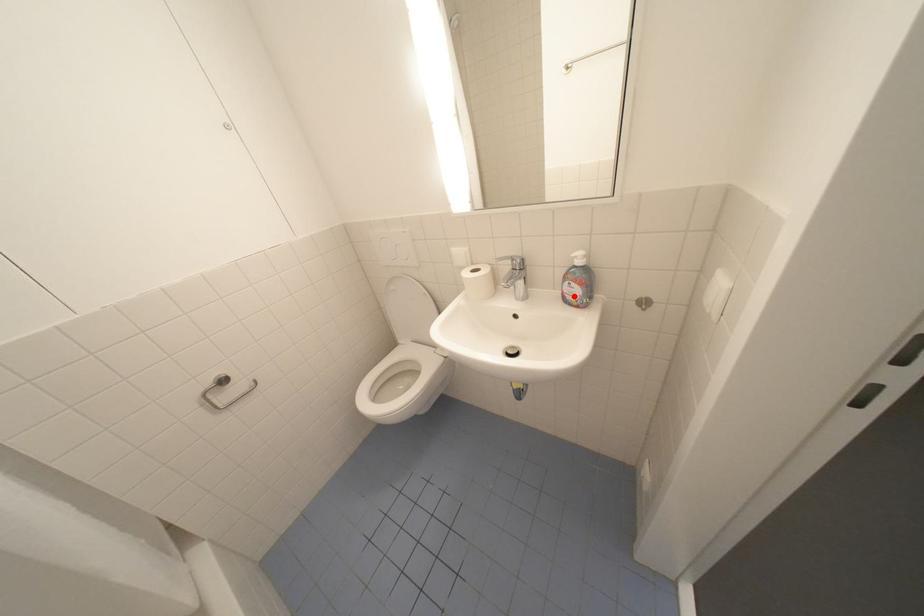
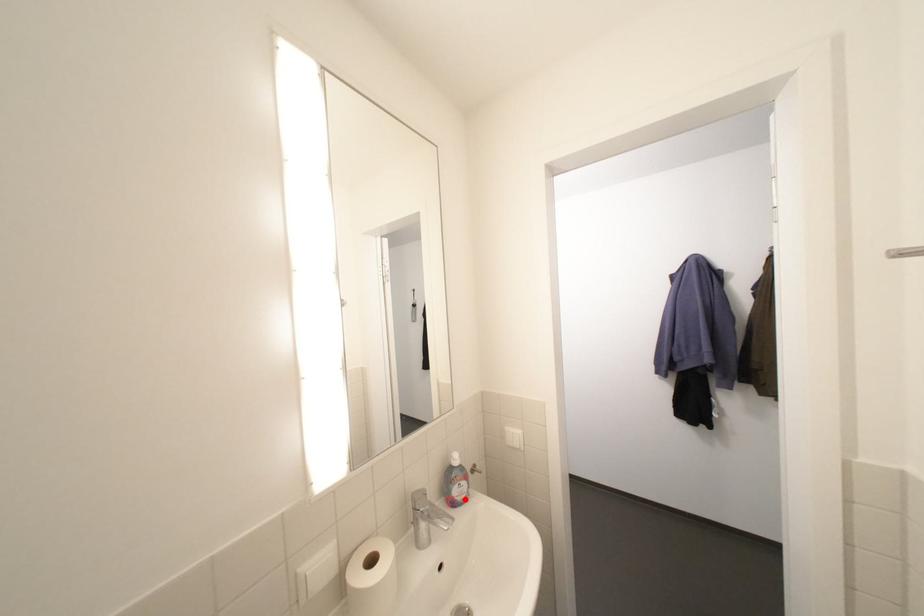
I am providing you with two images of the same scene from different viewpoints. A red point is marked on the first image and another point is marked on the second image. Do the highlighted points in image1 and image2 indicate the same real-world spot?

Yes